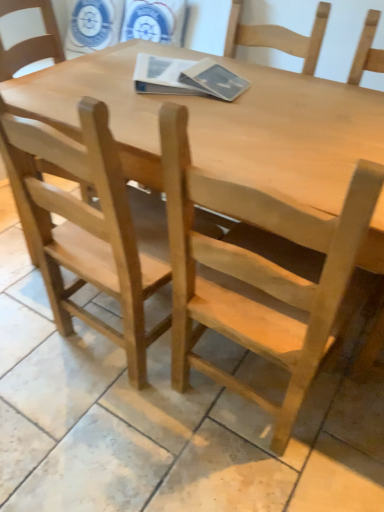
Locate an element on the screen. This screenshot has height=512, width=384. free region on the left part of natural wood chair at center, placed as the first chair when sorted from right to left is located at coordinates (123, 426).